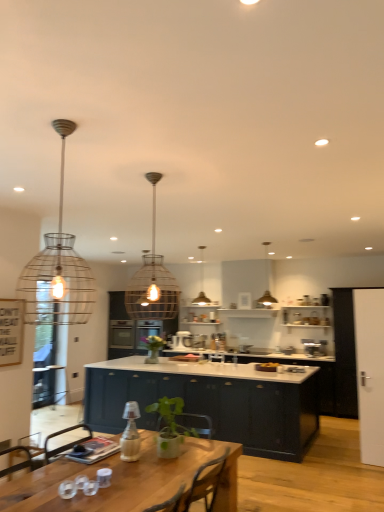
Question: Based on their sizes in the image, would you say metallic wire pendant light at upper center, the first lamp in the right-to-left sequence, is bigger or smaller than wooden table at lower left?

Choices:
 (A) big
 (B) small

Answer: (B)

Question: Is metallic wire pendant light at upper center, which ranks as the third lamp in front-to-back order, taller or shorter than wooden table at lower left?

Choices:
 (A) tall
 (B) short

Answer: (A)

Question: Which is farther from the glossy dark blue cabinet at center, which appears as the second cabinetry when viewed from the back?

Choices:
 (A) blue matte cabinet at center, acting as the first cabinetry starting from the back
 (B) satin silver mixer at center, acting as the 2th appliance starting from the right
 (C) wire mesh pendant light at upper left, the fourth lamp from the back
 (D) wooden table at lower left
 (E) metallic wire pendant light at upper center, which is counted as the second lamp, starting from the back

Answer: (C)

Question: Based on their relative distances, which object is farther from the green leafy plant at center, which is the first plant from right to left?

Choices:
 (A) metallic wire pendant light at center, the 3th lamp viewed from the left
 (B) wire mesh pendant light at center, the second lamp in the left-to-right sequence
 (C) metallic wire pendant light at upper center, the first lamp in the right-to-left sequence
 (D) satin silver mixer at center, acting as the 2th appliance starting from the right
 (E) wire mesh pendant light at upper left, which is the fourth lamp from right to left

Answer: (A)